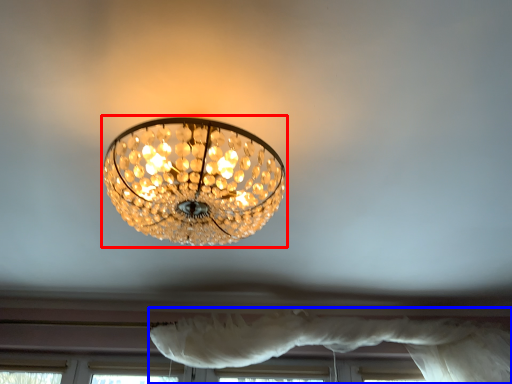
Question: Which point is further to the camera, lamp (highlighted by a red box) or curtain (highlighted by a blue box)?

Choices:
 (A) lamp
 (B) curtain

Answer: (B)